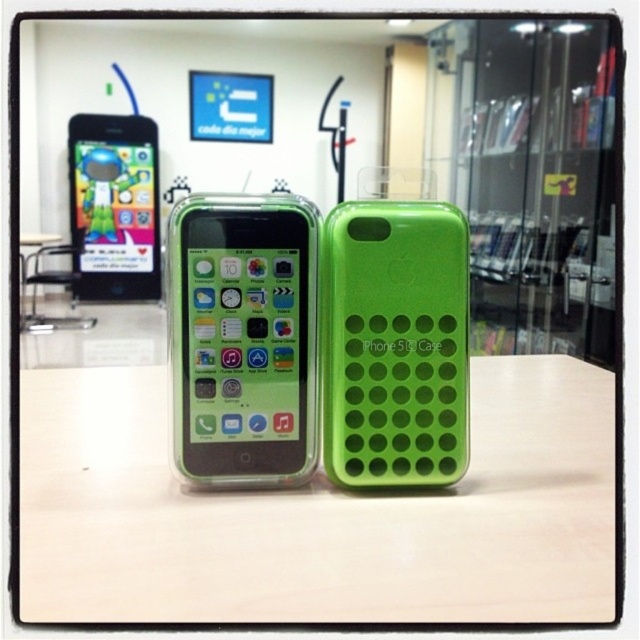
Question: Is white matte table at center behind green matte iphone case at center?

Choices:
 (A) yes
 (B) no

Answer: (B)

Question: Which object is closer to the camera taking this photo?

Choices:
 (A) white matte table at center
 (B) green matte smartphone at center
 (C) green matte iphone case at center

Answer: (A)

Question: Which is farther from the white matte table at center?

Choices:
 (A) green matte smartphone at center
 (B) green matte iphone case at center

Answer: (A)

Question: Which of the following is the farthest from the observer?

Choices:
 (A) (499, 620)
 (B) (401, 339)

Answer: (B)

Question: Is white matte table at center positioned at the back of green matte iphone case at center?

Choices:
 (A) no
 (B) yes

Answer: (A)

Question: Does green matte smartphone at center appear under green matte iphone case at center?

Choices:
 (A) no
 (B) yes

Answer: (A)